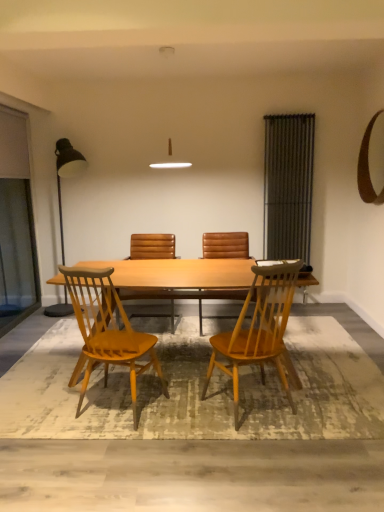
Describe the element at coordinates (288, 185) in the screenshot. I see `metallic gray radiator at right, the first screen door when ordered from right to left` at that location.

Measure the distance between brown leather chair at center, arranged as the 4th chair when viewed from the front, and camera.

4.10 meters.

This screenshot has height=512, width=384. I want to click on light brown wood chair at center, which is counted as the 4th chair, starting from the back, so click(258, 328).

What do you see at coordinates (178, 275) in the screenshot? This screenshot has height=512, width=384. I see `light brown wood table at center` at bounding box center [178, 275].

At what (x,y) coordinates should I click in order to perform the action: click on brown leather chair at center, the 3th chair in the front-to-back sequence. Please return your answer as a coordinate pair (x, y). Image resolution: width=384 pixels, height=512 pixels. Looking at the image, I should click on (225, 245).

Is transparent glass screen door at left, marked as the 2th screen door in a right-to-left arrangement, facing away from light brown wood table at center?

No, light brown wood table at center is not at the back of transparent glass screen door at left, marked as the 2th screen door in a right-to-left arrangement.

Considering the positions of point (19, 158) and point (87, 262), is point (19, 158) closer or farther from the camera than point (87, 262)?

Point (19, 158).

Is transparent glass screen door at left, placed as the 1th screen door when sorted from left to right, not near light brown wood table at center?

Yes, transparent glass screen door at left, placed as the 1th screen door when sorted from left to right, and light brown wood table at center are quite far apart.

Do you think transparent glass screen door at left, marked as the 2th screen door in a right-to-left arrangement, is within light brown wood table at center, or outside of it?

The correct answer is: outside.

Which is farther from the camera, [58,159] or [260,407]?

The point [58,159] is farther.

Could you tell me if metallic black floor lamp at left is facing textured beige rug at lower center?

No.

Is metallic black floor lamp at left next to textured beige rug at lower center?

No, metallic black floor lamp at left is not making contact with textured beige rug at lower center.

Is metallic black floor lamp at left to the left or to the right of textured beige rug at lower center in the image?

metallic black floor lamp at left is to the left of textured beige rug at lower center.

Is point (6, 148) positioned in front of point (81, 161)?

Yes, it is.

Looking at this image, is transparent glass screen door at left, marked as the 2th screen door in a right-to-left arrangement, smaller than metallic black floor lamp at left?

Yes.

Considering the relative positions of transparent glass screen door at left, marked as the 2th screen door in a right-to-left arrangement, and metallic black floor lamp at left in the image provided, is transparent glass screen door at left, marked as the 2th screen door in a right-to-left arrangement, behind metallic black floor lamp at left?

No, transparent glass screen door at left, marked as the 2th screen door in a right-to-left arrangement, is in front of metallic black floor lamp at left.

Between transparent glass screen door at left, marked as the 2th screen door in a right-to-left arrangement, and metallic black floor lamp at left, which one appears on the left side from the viewer's perspective?

From the viewer's perspective, transparent glass screen door at left, marked as the 2th screen door in a right-to-left arrangement, appears more on the left side.

The image size is (384, 512). I want to click on lamp on the left of brown leather chair at center, the 3th chair in the front-to-back sequence, so click(x=66, y=174).

Which of these two, brown leather chair at center, the 3th chair in the front-to-back sequence, or metallic black floor lamp at left, is bigger?

metallic black floor lamp at left is bigger.

From a real-world perspective, which object stands above the other?

metallic black floor lamp at left, from a real-world perspective.

Could metallic black floor lamp at left be considered to be inside brown leather chair at center, which ranks as the 2th chair in back-to-front order?

That's incorrect, metallic black floor lamp at left is not inside brown leather chair at center, which ranks as the 2th chair in back-to-front order.

This screenshot has height=512, width=384. In order to click on the 1st chair below the brown leather chair at center, arranged as the 4th chair when viewed from the front (from the image's perspective) in this screenshot , I will do `click(258, 328)`.

How different are the orientations of brown leather chair at center, placed as the first chair when sorted from back to front, and light brown wood chair at center, the first chair from the front, in degrees?

153 degrees.

From a real-world perspective, between brown leather chair at center, placed as the first chair when sorted from back to front, and light brown wood chair at center, the first chair from the front, who is vertically higher?

light brown wood chair at center, the first chair from the front, from a real-world perspective.

Is the surface of brown leather chair at center, arranged as the 4th chair when viewed from the front, in direct contact with light brown wood chair at center, the first chair from the front?

No, brown leather chair at center, arranged as the 4th chair when viewed from the front, is not touching light brown wood chair at center, the first chair from the front.

Are brown leather chair at center, the 3th chair in the front-to-back sequence, and light brown wood chair at center, the first chair from the front, making contact?

They are not placed beside each other.

Is brown leather chair at center, which ranks as the 2th chair in back-to-front order, to the right of light brown wood chair at center, the first chair from the front, from the viewer's perspective?

No.

Considering the relative sizes of brown leather chair at center, which ranks as the 2th chair in back-to-front order, and light brown wood chair at center, which is counted as the 4th chair, starting from the back, in the image provided, is brown leather chair at center, which ranks as the 2th chair in back-to-front order, thinner than light brown wood chair at center, which is counted as the 4th chair, starting from the back,?

No, brown leather chair at center, which ranks as the 2th chair in back-to-front order, is not thinner than light brown wood chair at center, which is counted as the 4th chair, starting from the back.

Is point (200, 333) in front of point (264, 279)?

No, it is behind (264, 279).

Visually, is transparent glass screen door at left, marked as the 2th screen door in a right-to-left arrangement, positioned to the left or to the right of brown leather chair at center, which ranks as the 2th chair in back-to-front order?

transparent glass screen door at left, marked as the 2th screen door in a right-to-left arrangement, is to the left of brown leather chair at center, which ranks as the 2th chair in back-to-front order.

Is point (11, 217) more distant than point (238, 232)?

No, it is in front of (238, 232).

From a real-world perspective, which is physically above, transparent glass screen door at left, placed as the 1th screen door when sorted from left to right, or brown leather chair at center, the 3th chair in the front-to-back sequence?

transparent glass screen door at left, placed as the 1th screen door when sorted from left to right, is physically above.

Could you tell me if transparent glass screen door at left, marked as the 2th screen door in a right-to-left arrangement, is turned towards brown leather chair at center, the 3th chair in the front-to-back sequence?

Yes, transparent glass screen door at left, marked as the 2th screen door in a right-to-left arrangement, is aimed at brown leather chair at center, the 3th chair in the front-to-back sequence.

Where is `kitchen & dining room table below the transparent glass screen door at left, marked as the 2th screen door in a right-to-left arrangement (from a real-world perspective)`? kitchen & dining room table below the transparent glass screen door at left, marked as the 2th screen door in a right-to-left arrangement (from a real-world perspective) is located at coordinates (178, 275).

Where is `lamp above the textured beige rug at lower center (from the image's perspective)`? The image size is (384, 512). lamp above the textured beige rug at lower center (from the image's perspective) is located at coordinates (66, 174).

From the image, which object appears to be farther from light brown wood chair at center, which is counted as the 4th chair, starting from the back, matte wood chair at center, which is the second chair from front to back, or metallic black floor lamp at left?

Based on the image, metallic black floor lamp at left appears to be further to light brown wood chair at center, which is counted as the 4th chair, starting from the back.

When comparing their distances from brown leather chair at center, which ranks as the 2th chair in back-to-front order, does transparent glass screen door at left, marked as the 2th screen door in a right-to-left arrangement, or textured beige rug at lower center seem further?

Based on the image, transparent glass screen door at left, marked as the 2th screen door in a right-to-left arrangement, appears to be further to brown leather chair at center, which ranks as the 2th chair in back-to-front order.

Based on their spatial positions, is metallic black floor lamp at left or metallic gray radiator at right, the first screen door when ordered from right to left, closer to light brown wood chair at center, the first chair from the front?

The object closer to light brown wood chair at center, the first chair from the front, is metallic gray radiator at right, the first screen door when ordered from right to left.

Which object lies nearer to the anchor point transparent glass screen door at left, placed as the 1th screen door when sorted from left to right, metallic gray radiator at right, which ranks as the second screen door in left-to-right order, or light brown wood table at center?

light brown wood table at center.

Which object lies nearer to the anchor point brown leather chair at center, placed as the first chair when sorted from back to front, matte wood chair at center, the 3th chair in the back-to-front sequence, or transparent glass screen door at left, placed as the 1th screen door when sorted from left to right?

transparent glass screen door at left, placed as the 1th screen door when sorted from left to right, is closer to brown leather chair at center, placed as the first chair when sorted from back to front.

Estimate the real-world distances between objects in this image. Which object is closer to transparent glass screen door at left, placed as the 1th screen door when sorted from left to right, light brown wood chair at center, which is counted as the 4th chair, starting from the back, or metallic gray radiator at right, the first screen door when ordered from right to left?

Based on the image, metallic gray radiator at right, the first screen door when ordered from right to left, appears to be nearer to transparent glass screen door at left, placed as the 1th screen door when sorted from left to right.

Which object lies nearer to the anchor point transparent glass screen door at left, placed as the 1th screen door when sorted from left to right, metallic gray radiator at right, which ranks as the second screen door in left-to-right order, or brown leather chair at center, arranged as the 4th chair when viewed from the front?

brown leather chair at center, arranged as the 4th chair when viewed from the front.

Estimate the real-world distances between objects in this image. Which object is further from matte wood chair at center, the 3th chair in the back-to-front sequence, textured beige rug at lower center or brown leather chair at center, arranged as the 4th chair when viewed from the front?

brown leather chair at center, arranged as the 4th chair when viewed from the front, is further to matte wood chair at center, the 3th chair in the back-to-front sequence.

The height and width of the screenshot is (512, 384). Identify the location of mat between light brown wood chair at center, which is counted as the 4th chair, starting from the back, and brown leather chair at center, the 3th chair in the front-to-back sequence, along the z-axis. (197, 390).

The height and width of the screenshot is (512, 384). I want to click on kitchen & dining room table located between textured beige rug at lower center and brown leather chair at center, which ranks as the 2th chair in back-to-front order, in the depth direction, so click(178, 275).

This screenshot has width=384, height=512. Find the location of `mat positioned between matte wood chair at center, the 3th chair in the back-to-front sequence, and brown leather chair at center, the 3th chair in the front-to-back sequence, from near to far`. mat positioned between matte wood chair at center, the 3th chair in the back-to-front sequence, and brown leather chair at center, the 3th chair in the front-to-back sequence, from near to far is located at coordinates (197, 390).

This screenshot has width=384, height=512. I want to click on lamp between transparent glass screen door at left, placed as the 1th screen door when sorted from left to right, and light brown wood table at center from left to right, so click(x=66, y=174).